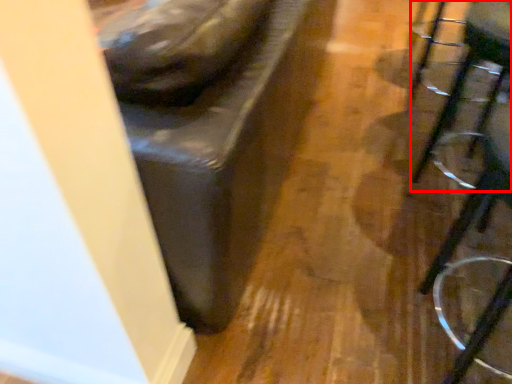
Question: From the image's perspective, what is the correct spatial relationship of swivel chair (annotated by the red box) in relation to furniture?

Choices:
 (A) below
 (B) above

Answer: (B)